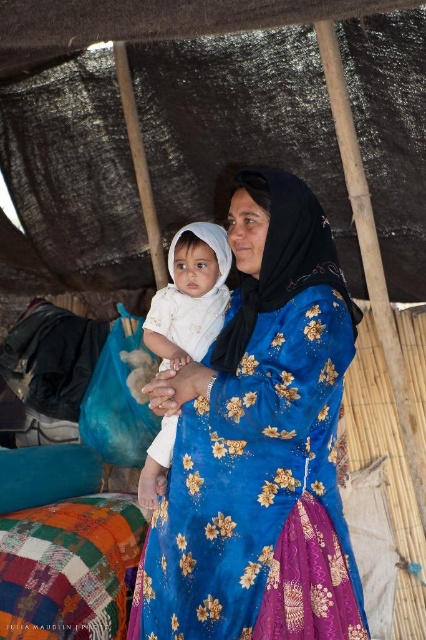
Question: Is blue satin dress at center above white cloth at center?

Choices:
 (A) yes
 (B) no

Answer: (B)

Question: From the image, what is the correct spatial relationship of blue satin dress at center in relation to white cloth at center?

Choices:
 (A) left
 (B) right

Answer: (B)

Question: Which of the following is the farthest from the observer?

Choices:
 (A) (158, 356)
 (B) (363, 618)

Answer: (A)

Question: Does blue satin dress at center come in front of white cloth at center?

Choices:
 (A) yes
 (B) no

Answer: (A)